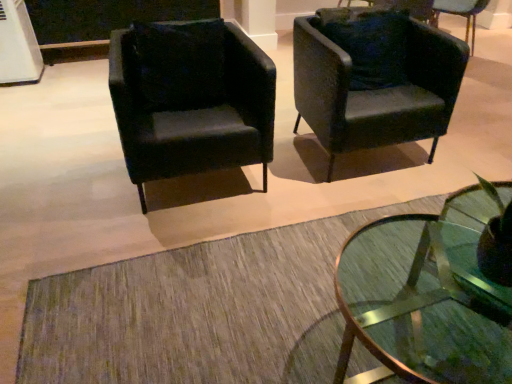
Where is `velvet black armchair at upper right, positioned as the first chair in right-to-left order`? The width and height of the screenshot is (512, 384). velvet black armchair at upper right, positioned as the first chair in right-to-left order is located at coordinates (461, 14).

Image resolution: width=512 pixels, height=384 pixels. Identify the location of velvet dark green pillow at center. (179, 64).

You are a GUI agent. You are given a task and a screenshot of the screen. Output one action in this format:
    pyautogui.click(x=<x>, y=<y>)
    Task: Click on the matte black armchair at left, which is counted as the 3th chair, starting from the right
    This screenshot has width=512, height=384.
    Given the screenshot: What is the action you would take?
    pyautogui.click(x=190, y=99)

In order to face matte black armchair at upper right, which ranks as the 2th chair in left-to-right order, should I rotate leftwards or rightwards?

To face it directly, rotate right by 14.533 degrees.

Where is `velvet black armchair at upper right, positioned as the first chair in right-to-left order`? The image size is (512, 384). velvet black armchair at upper right, positioned as the first chair in right-to-left order is located at coordinates (461, 14).

Which is farther, [298,64] or [470,355]?

The point [298,64] is behind.

Is matte black armchair at upper right, placed as the second chair when sorted from right to left, to the left of clear glass coffee table at lower center from the viewer's perspective?

Correct, you'll find matte black armchair at upper right, placed as the second chair when sorted from right to left, to the left of clear glass coffee table at lower center.

Is matte black armchair at upper right, which ranks as the 2th chair in left-to-right order, aimed at clear glass coffee table at lower center?

Yes, matte black armchair at upper right, which ranks as the 2th chair in left-to-right order, is turned towards clear glass coffee table at lower center.

Is matte black armchair at upper right, which ranks as the 2th chair in left-to-right order, inside the boundaries of clear glass coffee table at lower center, or outside?

matte black armchair at upper right, which ranks as the 2th chair in left-to-right order, cannot be found inside clear glass coffee table at lower center.

Considering the positions of objects matte black armchair at upper right, placed as the second chair when sorted from right to left, and velvet black armchair at upper right, arranged as the third chair when viewed from the left, in the image provided, who is more to the left, matte black armchair at upper right, placed as the second chair when sorted from right to left, or velvet black armchair at upper right, arranged as the third chair when viewed from the left,?

matte black armchair at upper right, placed as the second chair when sorted from right to left, is more to the left.

Who is bigger, matte black armchair at upper right, placed as the second chair when sorted from right to left, or velvet black armchair at upper right, positioned as the first chair in right-to-left order?

With larger size is matte black armchair at upper right, placed as the second chair when sorted from right to left.

From the image's perspective, is matte black armchair at upper right, which ranks as the 2th chair in left-to-right order, on velvet black armchair at upper right, arranged as the third chair when viewed from the left?

Incorrect, from the image's perspective, matte black armchair at upper right, which ranks as the 2th chair in left-to-right order, is lower than velvet black armchair at upper right, arranged as the third chair when viewed from the left.

Which is closer, (315, 64) or (465, 8)?

Point (315, 64) is positioned closer to the camera compared to point (465, 8).

Is matte black armchair at upper right, which ranks as the 2th chair in left-to-right order, outside of velvet dark green pillow at center?

matte black armchair at upper right, which ranks as the 2th chair in left-to-right order, is positioned outside velvet dark green pillow at center.

Looking at this image, how far apart are matte black armchair at upper right, placed as the second chair when sorted from right to left, and velvet dark green pillow at center?

matte black armchair at upper right, placed as the second chair when sorted from right to left, is 29.94 inches away from velvet dark green pillow at center.

Could you tell me if matte black armchair at upper right, placed as the second chair when sorted from right to left, is turned towards velvet dark green pillow at center?

No, matte black armchair at upper right, placed as the second chair when sorted from right to left, is not aimed at velvet dark green pillow at center.

Is clear glass coffee table at lower center positioned with its back to matte black armchair at left, which is the 1th chair in left-to-right order?

No, clear glass coffee table at lower center's orientation is not away from matte black armchair at left, which is the 1th chair in left-to-right order.

Between clear glass coffee table at lower center and matte black armchair at left, which is counted as the 3th chair, starting from the right, which one has smaller size?

With smaller size is clear glass coffee table at lower center.

Which object is positioned more to the left, clear glass coffee table at lower center or matte black armchair at left, which is counted as the 3th chair, starting from the right?

From the viewer's perspective, matte black armchair at left, which is counted as the 3th chair, starting from the right, appears more on the left side.

Find the location of a particular element. The width and height of the screenshot is (512, 384). chair that is the 2nd object to the left of the clear glass coffee table at lower center, starting at the anchor is located at coordinates (190, 99).

Considering the sizes of objects velvet dark green pillow at center and matte black armchair at left, which is the 1th chair in left-to-right order, in the image provided, who is wider, velvet dark green pillow at center or matte black armchair at left, which is the 1th chair in left-to-right order,?

matte black armchair at left, which is the 1th chair in left-to-right order.

Does velvet dark green pillow at center touch matte black armchair at left, which is counted as the 3th chair, starting from the right?

Indeed, velvet dark green pillow at center and matte black armchair at left, which is counted as the 3th chair, starting from the right, are beside each other and touching.

Can matte black armchair at left, which is the 1th chair in left-to-right order, be found inside velvet dark green pillow at center?

No, matte black armchair at left, which is the 1th chair in left-to-right order, is not inside velvet dark green pillow at center.

From the image's perspective, does velvet dark green pillow at center appear higher than matte black armchair at left, which is the 1th chair in left-to-right order?

Indeed, from the image's perspective, velvet dark green pillow at center is shown above matte black armchair at left, which is the 1th chair in left-to-right order.

Is matte black armchair at left, which is the 1th chair in left-to-right order, positioned far away from matte black armchair at upper right, placed as the second chair when sorted from right to left?

No, there isn't a large distance between matte black armchair at left, which is the 1th chair in left-to-right order, and matte black armchair at upper right, placed as the second chair when sorted from right to left.

Between matte black armchair at left, which is the 1th chair in left-to-right order, and matte black armchair at upper right, placed as the second chair when sorted from right to left, which one has smaller width?

Thinner between the two is matte black armchair at upper right, placed as the second chair when sorted from right to left.

In terms of width, does matte black armchair at left, which is counted as the 3th chair, starting from the right, look wider or thinner when compared to velvet dark green pillow at center?

In the image, matte black armchair at left, which is counted as the 3th chair, starting from the right, appears to be wider than velvet dark green pillow at center.

Consider the image. From a real-world perspective, is matte black armchair at left, which is counted as the 3th chair, starting from the right, below velvet dark green pillow at center?

Correct, in the physical world, matte black armchair at left, which is counted as the 3th chair, starting from the right, is lower than velvet dark green pillow at center.

You are a GUI agent. You are given a task and a screenshot of the screen. Output one action in this format:
    pyautogui.click(x=<x>, y=<y>)
    Task: Click on the chair to the left of velvet dark green pillow at center
    
    Given the screenshot: What is the action you would take?
    [x=190, y=99]

Is point (212, 19) farther from camera compared to point (139, 83)?

Yes, it is behind point (139, 83).

From a real-world perspective, count 2nd chairs upward from the clear glass coffee table at lower center and point to it. Please provide its 2D coordinates.

[(377, 89)]

Identify the location of chair above the matte black armchair at upper right, placed as the second chair when sorted from right to left (from the image's perspective). (461, 14).

Considering their positions, is velvet black armchair at upper right, positioned as the first chair in right-to-left order, positioned closer to clear glass coffee table at lower center than matte black armchair at upper right, placed as the second chair when sorted from right to left?

Based on the image, matte black armchair at upper right, placed as the second chair when sorted from right to left, appears to be nearer to clear glass coffee table at lower center.

Based on the photo, considering their positions, is matte black armchair at left, which is counted as the 3th chair, starting from the right, positioned closer to velvet dark green pillow at center than matte black armchair at upper right, which ranks as the 2th chair in left-to-right order?

matte black armchair at left, which is counted as the 3th chair, starting from the right, is positioned closer to the anchor velvet dark green pillow at center.

Looking at the image, which one is located further to velvet black armchair at upper right, arranged as the third chair when viewed from the left, matte black armchair at left, which is the 1th chair in left-to-right order, or clear glass coffee table at lower center?

clear glass coffee table at lower center lies further to velvet black armchair at upper right, arranged as the third chair when viewed from the left, than the other object.

Considering their positions, is matte black armchair at left, which is the 1th chair in left-to-right order, positioned closer to matte black armchair at upper right, which ranks as the 2th chair in left-to-right order, than clear glass coffee table at lower center?

matte black armchair at left, which is the 1th chair in left-to-right order, lies closer to matte black armchair at upper right, which ranks as the 2th chair in left-to-right order, than the other object.

Considering their positions, is velvet black armchair at upper right, arranged as the third chair when viewed from the left, positioned further to velvet dark green pillow at center than clear glass coffee table at lower center?

Among the two, velvet black armchair at upper right, arranged as the third chair when viewed from the left, is located further to velvet dark green pillow at center.

Looking at the image, which one is located closer to velvet black armchair at upper right, arranged as the third chair when viewed from the left, matte black armchair at left, which is counted as the 3th chair, starting from the right, or matte black armchair at upper right, placed as the second chair when sorted from right to left?

matte black armchair at upper right, placed as the second chair when sorted from right to left.

When comparing their distances from clear glass coffee table at lower center, does matte black armchair at upper right, which ranks as the 2th chair in left-to-right order, or velvet dark green pillow at center seem closer?

matte black armchair at upper right, which ranks as the 2th chair in left-to-right order.

In the scene shown: Looking at the image, which one is located closer to matte black armchair at left, which is counted as the 3th chair, starting from the right, matte black armchair at upper right, placed as the second chair when sorted from right to left, or velvet black armchair at upper right, positioned as the first chair in right-to-left order?

matte black armchair at upper right, placed as the second chair when sorted from right to left, is positioned closer to the anchor matte black armchair at left, which is counted as the 3th chair, starting from the right.

This screenshot has width=512, height=384. I want to click on chair between matte black armchair at left, which is counted as the 3th chair, starting from the right, and velvet black armchair at upper right, positioned as the first chair in right-to-left order, in the horizontal direction, so click(x=377, y=89).

Where is `pillow between matte black armchair at left, which is counted as the 3th chair, starting from the right, and matte black armchair at upper right, placed as the second chair when sorted from right to left, from left to right`? pillow between matte black armchair at left, which is counted as the 3th chair, starting from the right, and matte black armchair at upper right, placed as the second chair when sorted from right to left, from left to right is located at coordinates (179, 64).

Where is `pillow between matte black armchair at left, which is counted as the 3th chair, starting from the right, and clear glass coffee table at lower center, in the horizontal direction`? pillow between matte black armchair at left, which is counted as the 3th chair, starting from the right, and clear glass coffee table at lower center, in the horizontal direction is located at coordinates click(179, 64).

At what (x,y) coordinates should I click in order to perform the action: click on chair between velvet dark green pillow at center and clear glass coffee table at lower center in the horizontal direction. Please return your answer as a coordinate pair (x, y). The height and width of the screenshot is (384, 512). Looking at the image, I should click on (377, 89).